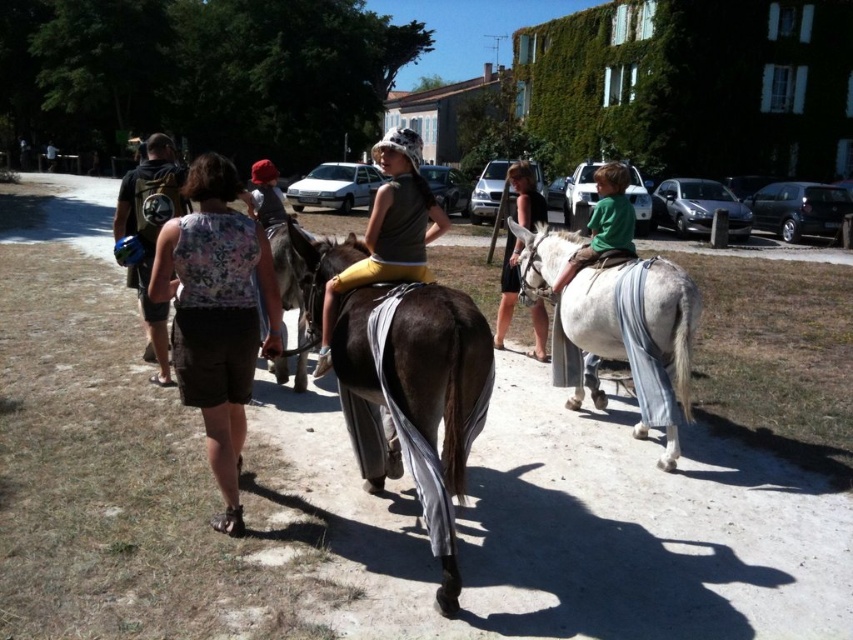
Question: Which point is farther to the camera?

Choices:
 (A) brown matte mule at center
 (B) floral fabric top at center
 (C) green cotton shirt at right
 (D) camouflage fabric backpack at left

Answer: (C)

Question: Is brown matte mule at center positioned in front of floral fabric top at center?

Choices:
 (A) yes
 (B) no

Answer: (A)

Question: Estimate the real-world distances between objects in this image. Which object is closer to the camouflage fabric backpack at left?

Choices:
 (A) brown matte mule at center
 (B) brown leather horse at center

Answer: (A)

Question: Considering the real-world distances, which object is closest to the camouflage fabric backpack at left?

Choices:
 (A) green cotton shirt at right
 (B) white cloth-covered mule at right
 (C) floral fabric top at center

Answer: (C)

Question: Can you confirm if white cloth-covered mule at right is thinner than green cotton shirt at right?

Choices:
 (A) no
 (B) yes

Answer: (A)

Question: Where is floral fabric top at center located in relation to green cotton shirt at right in the image?

Choices:
 (A) below
 (B) above

Answer: (A)